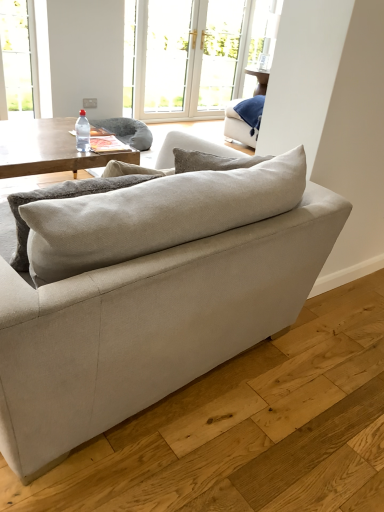
You are a GUI agent. You are given a task and a screenshot of the screen. Output one action in this format:
    pyautogui.click(x=<x>, y=<y>)
    Task: Click on the vacant space in front of transparent plastic bottle at center
    
    Given the screenshot: What is the action you would take?
    pyautogui.click(x=68, y=155)